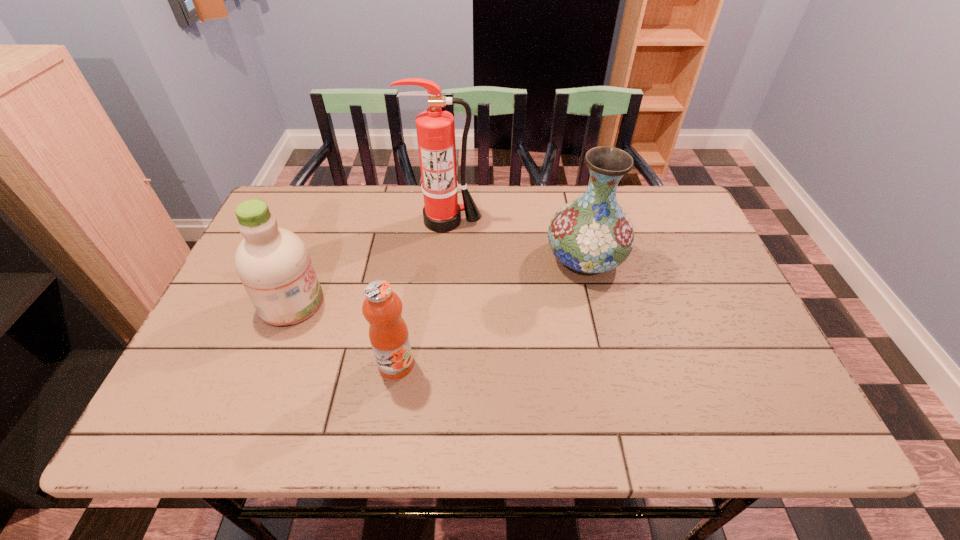
I want to click on vase that is at the far edge, so click(592, 234).

Locate an element on the screen. The height and width of the screenshot is (540, 960). object located at the left edge is located at coordinates (273, 264).

Image resolution: width=960 pixels, height=540 pixels. I want to click on vacant area at the far edge of the desktop, so click(327, 232).

Identify the location of vacant space at the near edge of the desktop. This screenshot has width=960, height=540. (668, 428).

Locate an element on the screen. The image size is (960, 540). free spot at the left edge of the desktop is located at coordinates (238, 280).

You are a GUI agent. You are given a task and a screenshot of the screen. Output one action in this format:
    pyautogui.click(x=<x>, y=<y>)
    Task: Click on the free space at the right edge
    The image size is (960, 540).
    Given the screenshot: What is the action you would take?
    pyautogui.click(x=708, y=347)

I want to click on vacant space at the near left corner, so click(187, 423).

In the image, there is a desktop. What are the coordinates of `blank space at the far right corner` in the screenshot? It's located at (680, 202).

Locate an element on the screen. This screenshot has height=540, width=960. free space at the near right corner is located at coordinates (767, 437).

Where is `unoccupied position between the fruit juice and the rightmost object`? This screenshot has width=960, height=540. unoccupied position between the fruit juice and the rightmost object is located at coordinates (491, 312).